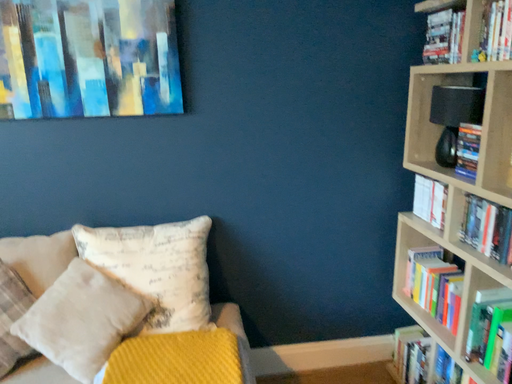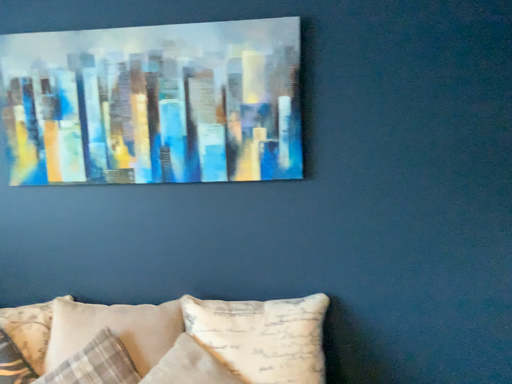
Question: How did the camera likely rotate when shooting the video?

Choices:
 (A) rotated downward
 (B) rotated upward

Answer: (B)